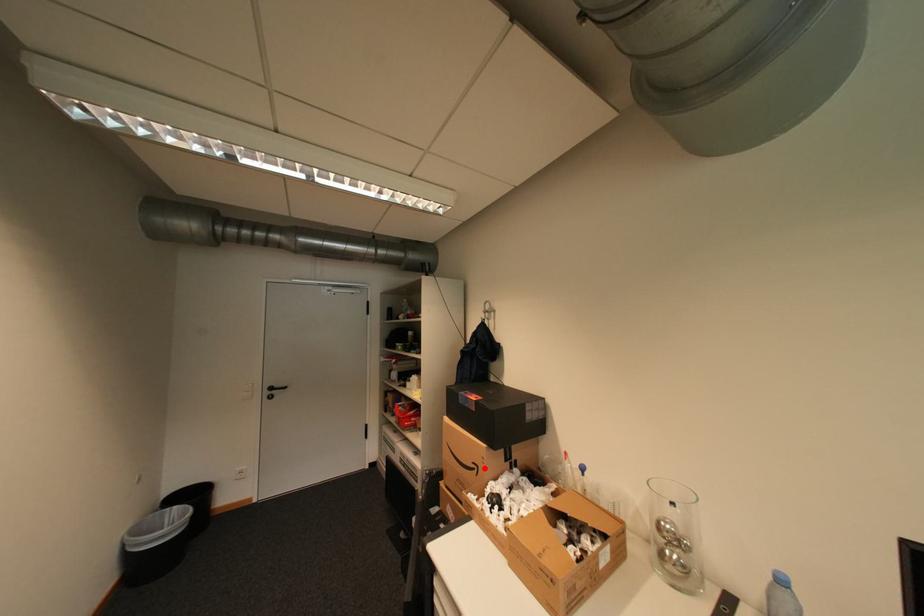
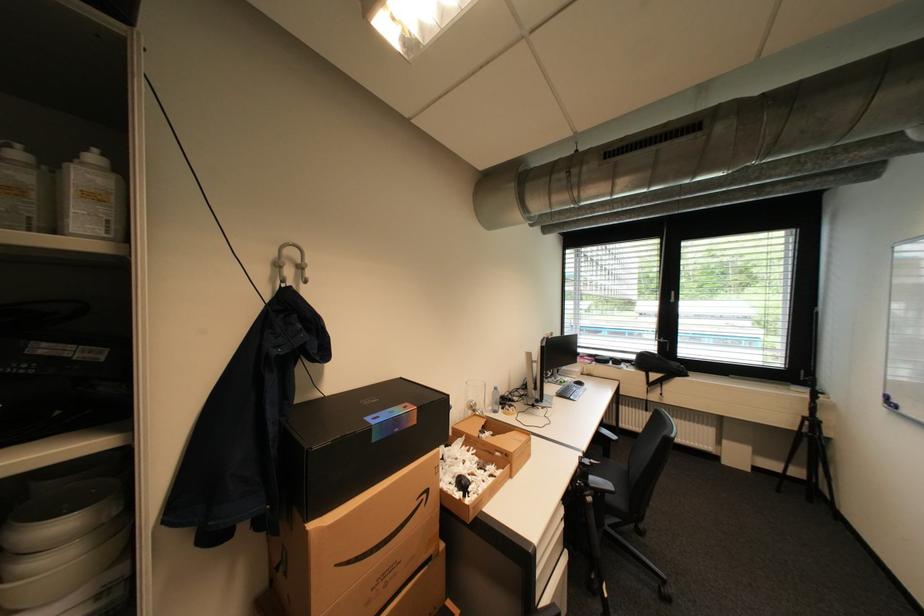
Find the pixel in the second image that matches the highlighted location in the first image.

(433, 496)